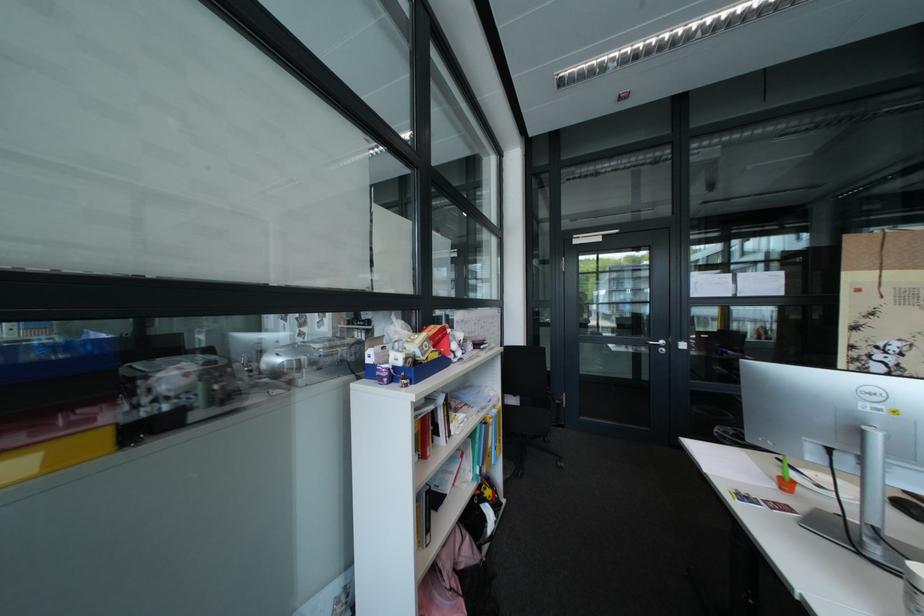
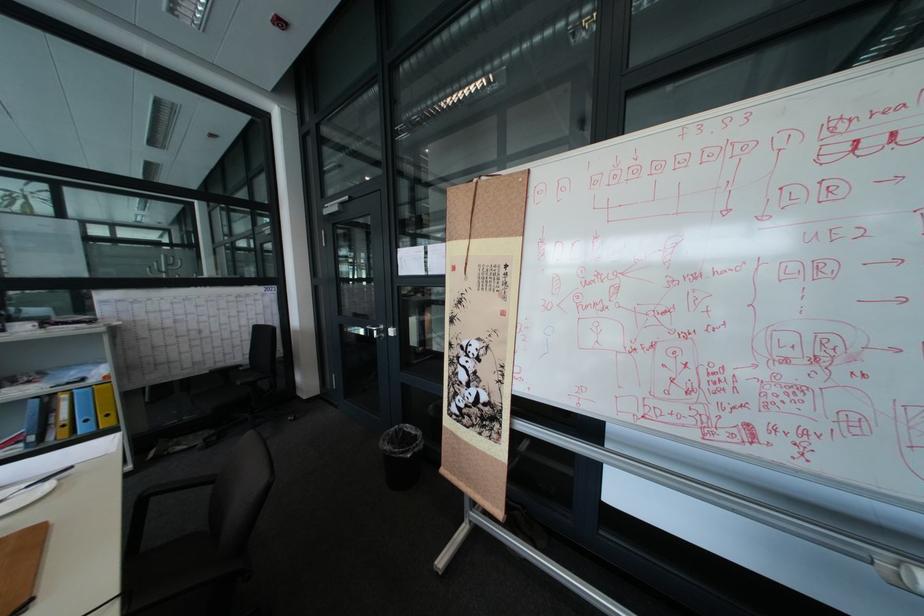
Question: What movement of the cameraman would produce the second image?

Choices:
 (A) Left
 (B) Right
 (C) Forward
 (D) Backward

Answer: (B)